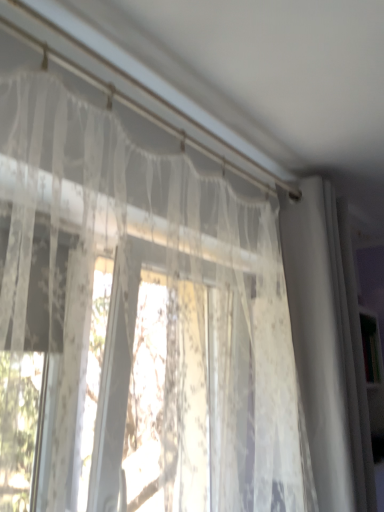
What do you see at coordinates (139, 320) in the screenshot? I see `sheer white curtain at center` at bounding box center [139, 320].

You are a GUI agent. You are given a task and a screenshot of the screen. Output one action in this format:
    pyautogui.click(x=<x>, y=<y>)
    Task: Click on the sheer white curtain at center
    Image resolution: width=384 pixels, height=512 pixels.
    Given the screenshot: What is the action you would take?
    pyautogui.click(x=139, y=320)

This screenshot has height=512, width=384. Identify the location of sheer white curtain at center. (139, 320).